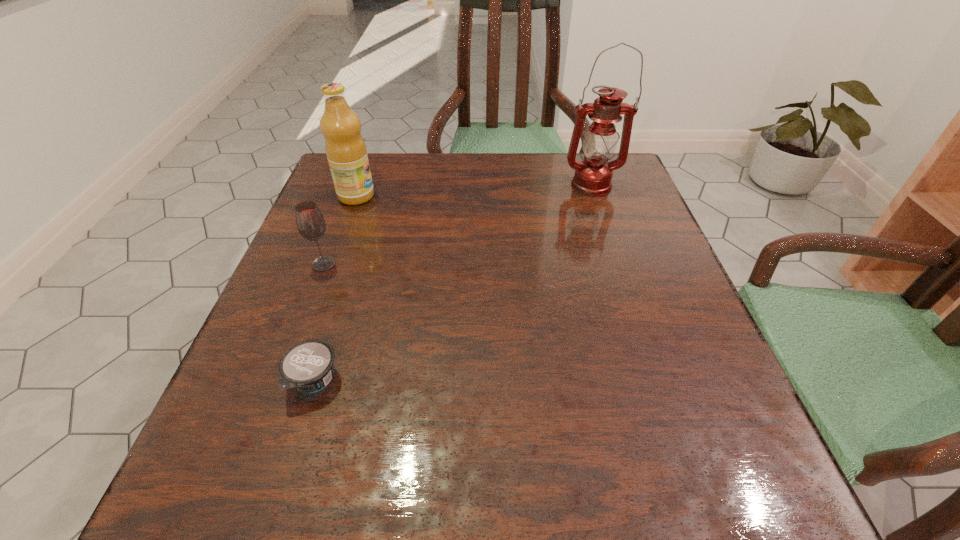
Identify the location of the rightmost object. (593, 175).

This screenshot has width=960, height=540. I want to click on the tallest object, so click(593, 175).

The width and height of the screenshot is (960, 540). In order to click on olive oil in this screenshot , I will do `click(345, 148)`.

I want to click on glass drink container, so click(311, 225).

Find the location of a particular element. Image resolution: width=960 pixels, height=540 pixels. the second shortest object is located at coordinates (311, 225).

I want to click on the shortest object, so click(x=307, y=366).

Where is `the nearest object`? This screenshot has height=540, width=960. the nearest object is located at coordinates (307, 366).

Locate an element on the screen. vacant space located on the front of the oil lamp is located at coordinates (598, 209).

Where is `vacant area situated on the label of the second tallest object`? This screenshot has height=540, width=960. vacant area situated on the label of the second tallest object is located at coordinates (454, 196).

Identify the location of vacant region located on the back of the glass drink container. This screenshot has width=960, height=540. (358, 173).